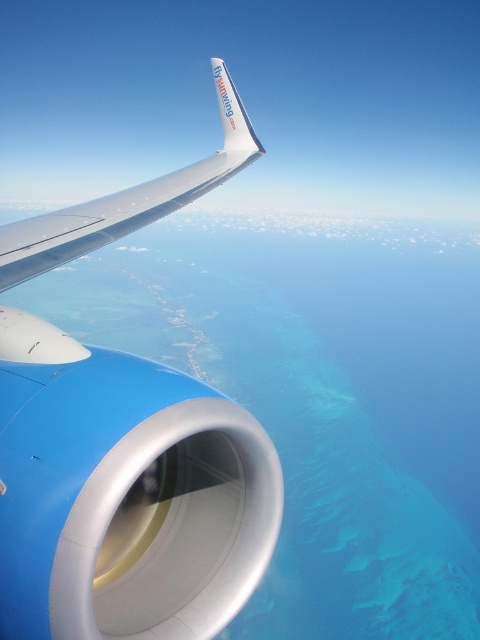
Is point (168, 572) farther from viewer compared to point (162, 198)?

No, it is in front of (162, 198).

Is metallic silver wing at upper left thinner than silver metallic wing at upper left?

No, metallic silver wing at upper left is not thinner than silver metallic wing at upper left.

Locate an element on the screen. The height and width of the screenshot is (640, 480). metallic silver wing at upper left is located at coordinates (123, 493).